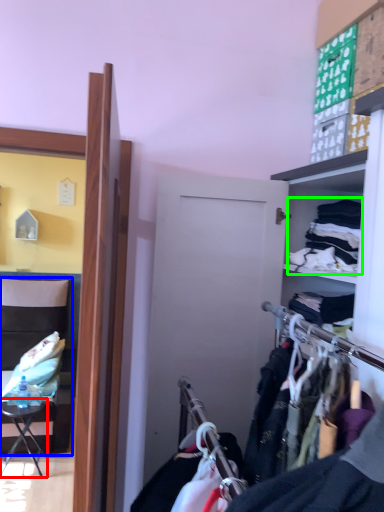
Question: Based on their relative distances, which object is farther from table (highlighted by a red box)? Choose from chair (highlighted by a blue box) and clothing (highlighted by a green box).

Choices:
 (A) chair
 (B) clothing

Answer: (B)